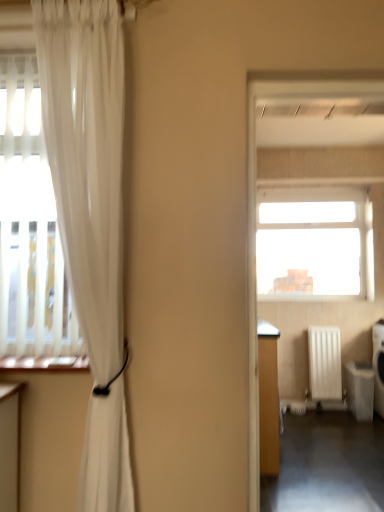
Question: Is white matte radiator at right surrounded by dark gray concrete corridor at lower right?

Choices:
 (A) yes
 (B) no

Answer: (B)

Question: From the image's perspective, is dark gray concrete corridor at lower right below white matte radiator at right?

Choices:
 (A) no
 (B) yes

Answer: (B)

Question: Can you confirm if dark gray concrete corridor at lower right is wider than white matte radiator at right?

Choices:
 (A) no
 (B) yes

Answer: (B)

Question: Is dark gray concrete corridor at lower right looking in the opposite direction of white matte radiator at right?

Choices:
 (A) yes
 (B) no

Answer: (B)

Question: From a real-world perspective, is dark gray concrete corridor at lower right over white matte radiator at right?

Choices:
 (A) no
 (B) yes

Answer: (A)

Question: In terms of width, does translucent white curtain at left look wider or thinner when compared to transparent glass window at upper center?

Choices:
 (A) wide
 (B) thin

Answer: (A)

Question: Is translucent white curtain at left situated inside transparent glass window at upper center or outside?

Choices:
 (A) outside
 (B) inside

Answer: (A)

Question: Considering their positions, is translucent white curtain at left located in front of or behind transparent glass window at upper center?

Choices:
 (A) front
 (B) behind

Answer: (A)

Question: From the image's perspective, relative to transparent glass window at upper center, is translucent white curtain at left above or below?

Choices:
 (A) above
 (B) below

Answer: (B)

Question: Considering the positions of dark gray concrete corridor at lower right and transparent glass window at upper center in the image, is dark gray concrete corridor at lower right wider or thinner than transparent glass window at upper center?

Choices:
 (A) thin
 (B) wide

Answer: (B)

Question: Is dark gray concrete corridor at lower right situated inside transparent glass window at upper center or outside?

Choices:
 (A) outside
 (B) inside

Answer: (A)

Question: Considering the positions of dark gray concrete corridor at lower right and transparent glass window at upper center in the image, is dark gray concrete corridor at lower right taller or shorter than transparent glass window at upper center?

Choices:
 (A) short
 (B) tall

Answer: (A)

Question: In terms of size, does dark gray concrete corridor at lower right appear bigger or smaller than transparent glass window at upper center?

Choices:
 (A) big
 (B) small

Answer: (A)

Question: Would you say white plastic dishwasher at lower right is to the left or to the right of transparent glass window at upper center in the picture?

Choices:
 (A) left
 (B) right

Answer: (B)

Question: Is point (367, 369) closer or farther from the camera than point (342, 194)?

Choices:
 (A) farther
 (B) closer

Answer: (B)